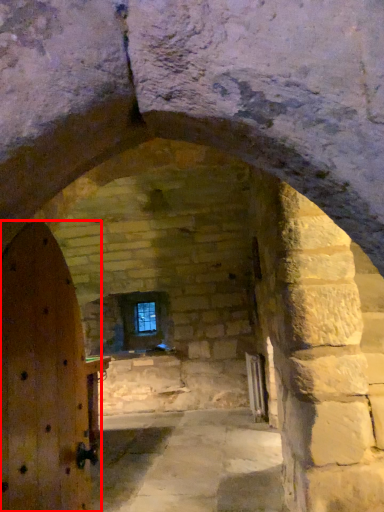
Question: From the image's perspective, considering the relative positions of door (annotated by the red box) and window in the image provided, where is door (annotated by the red box) located with respect to the staircase?

Choices:
 (A) above
 (B) below

Answer: (A)